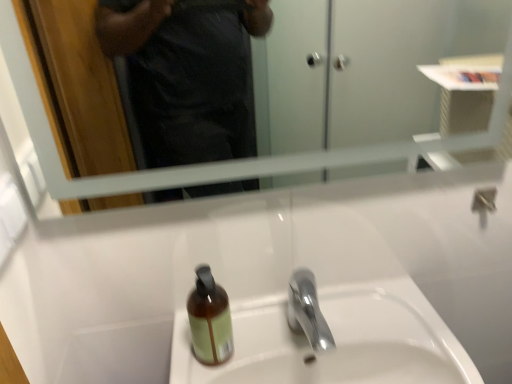
Question: From their relative heights in the image, would you say clear glass mirror at upper center is taller or shorter than white ceramic sink at center?

Choices:
 (A) tall
 (B) short

Answer: (A)

Question: From a real-world perspective, relative to white ceramic sink at center, is clear glass mirror at upper center vertically above or below?

Choices:
 (A) below
 (B) above

Answer: (B)

Question: Which is nearer to the brown glass bottle at center?

Choices:
 (A) polished chrome faucet at center
 (B) clear glass mirror at upper center
 (C) white ceramic sink at center

Answer: (A)

Question: Which object is the farthest from the polished chrome faucet at center?

Choices:
 (A) clear glass mirror at upper center
 (B) white ceramic sink at center
 (C) brown glass bottle at center

Answer: (A)